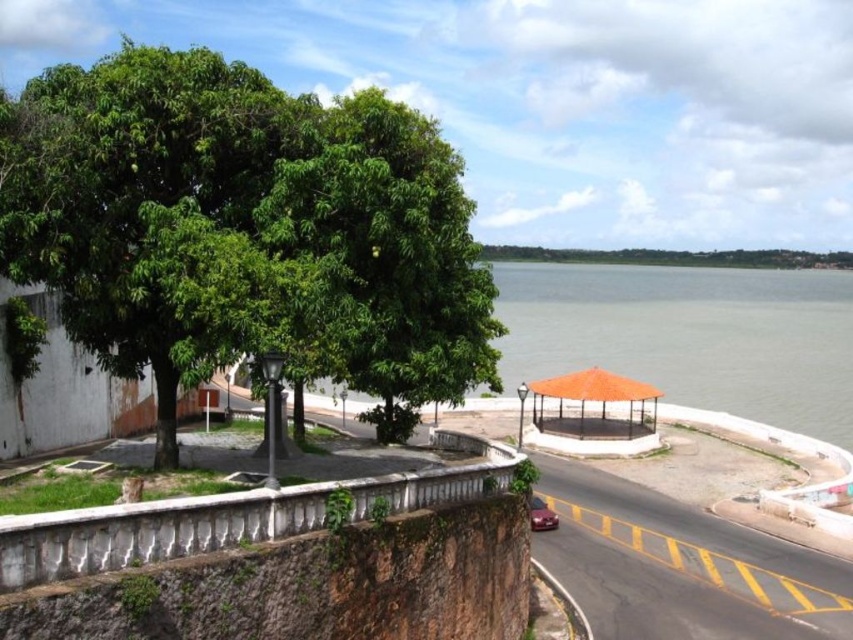
Does green leafy tree at upper left lie in front of shiny red car at lower center?

Yes, green leafy tree at upper left is in front of shiny red car at lower center.

Can you confirm if green leafy tree at upper left is taller than shiny red car at lower center?

Yes, green leafy tree at upper left is taller than shiny red car at lower center.

Who is more forward, (x=341, y=355) or (x=546, y=525)?

Point (x=341, y=355) is more forward.

I want to click on green leafy tree at upper left, so pyautogui.click(x=248, y=230).